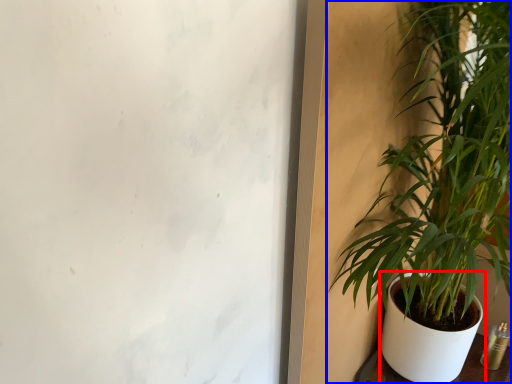
Question: Which object is closer to the camera taking this photo, flowerpot (highlighted by a red box) or houseplant (highlighted by a blue box)?

Choices:
 (A) flowerpot
 (B) houseplant

Answer: (B)